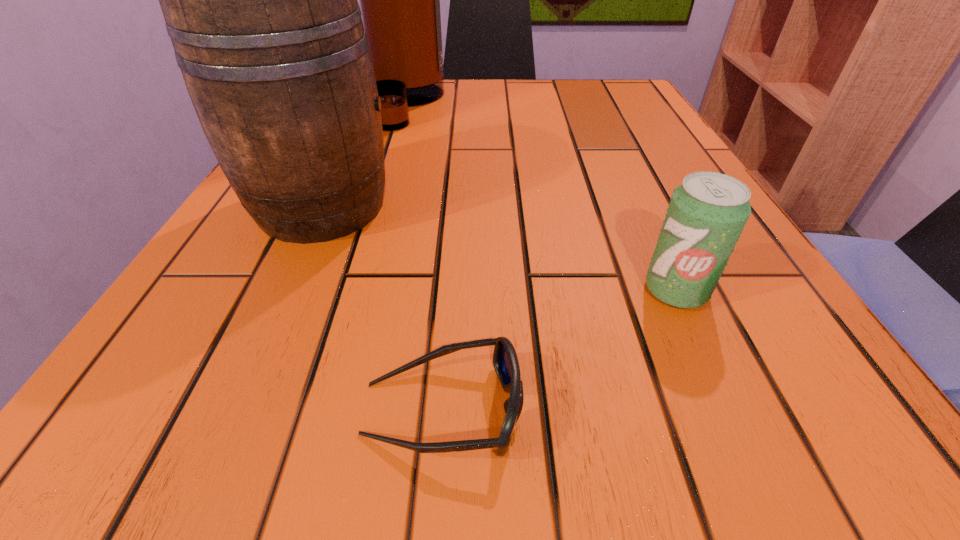
This screenshot has height=540, width=960. In order to click on free point between the sunglasses and the farthest object in this screenshot , I will do `click(424, 256)`.

The width and height of the screenshot is (960, 540). I want to click on vacant point located between the tallest object and the sunglasses, so click(x=424, y=256).

Where is `vacant point located between the farthest object and the soda`? This screenshot has width=960, height=540. vacant point located between the farthest object and the soda is located at coordinates (541, 197).

The image size is (960, 540). Find the location of `object that is the second closest to the sunglasses`. object that is the second closest to the sunglasses is located at coordinates (x=260, y=1).

Identify which object is located as the third nearest to the nearest object. Please provide its 2D coordinates. Your answer should be formatted as a tuple, i.e. [(x, y)], where the tuple contains the x and y coordinates of a point satisfying the conditions above.

[(399, 0)]

This screenshot has width=960, height=540. In order to click on free spot that satisfies the following two spatial constraints: 1. on the front label of the rightmost object; 2. on the right side of the liquor in this screenshot , I will do `click(349, 290)`.

Image resolution: width=960 pixels, height=540 pixels. I want to click on vacant area that satisfies the following two spatial constraints: 1. on the front label of the farthest object; 2. on the left side of the soda, so click(x=349, y=290).

At what (x,y) coordinates should I click in order to perform the action: click on free space that satisfies the following two spatial constraints: 1. on the front side of the rightmost object; 2. on the front-facing side of the sunglasses. Please return your answer as a coordinate pair (x, y). This screenshot has width=960, height=540. Looking at the image, I should click on (730, 409).

This screenshot has height=540, width=960. In order to click on free point that satisfies the following two spatial constraints: 1. on the side of the third shortest object near the bung hole; 2. on the right side of the rightmost object in this screenshot , I will do `click(283, 290)`.

Find the location of a particular element. free space that satisfies the following two spatial constraints: 1. on the front label of the second nearest object; 2. on the left side of the tallest object is located at coordinates (349, 290).